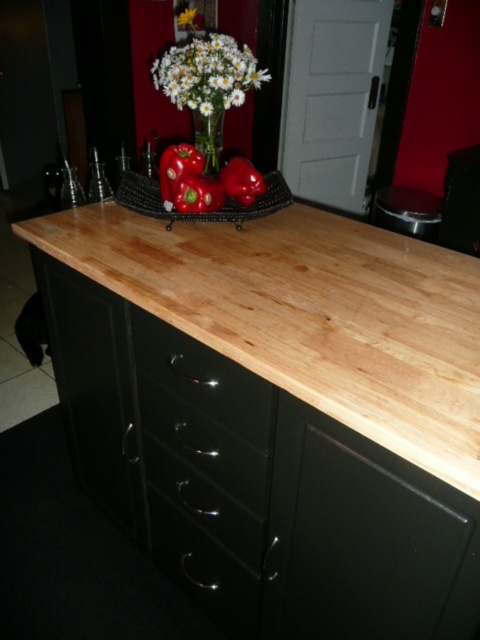
You are arranging a centerpiece on the kitchen counter. You have a green matte bell pepper at center and a white matte flower at center. Which object should you choose if you want to place a smaller item in the middle?

The green matte bell pepper at center is smaller in size compared to the white matte flower at center, so it would be the better choice for a smaller item in the middle.

You are arranging items on the kitchen counter and want to place a small bowl between the green matte bell pepper at center and the white matte flower at upper center. Based on their widths, which item should you position closer to the edge of the counter to ensure the bowl fits?

The green matte bell pepper at center might be wider than the white matte flower at upper center, so positioning the bowl closer to the narrower white matte flower at upper center would allow more space for the wider bell pepper.

You are arranging flowers on a kitchen counter and want to place a new vase between the white matte flower at center and the white matte flower at upper center. The vase is 5 inches wide. Is there enough space between them to fit the vase?

The distance between the white matte flower at center and the white matte flower at upper center is 10.24 inches. Since the vase is 5 inches wide, there is enough space to fit it between them.